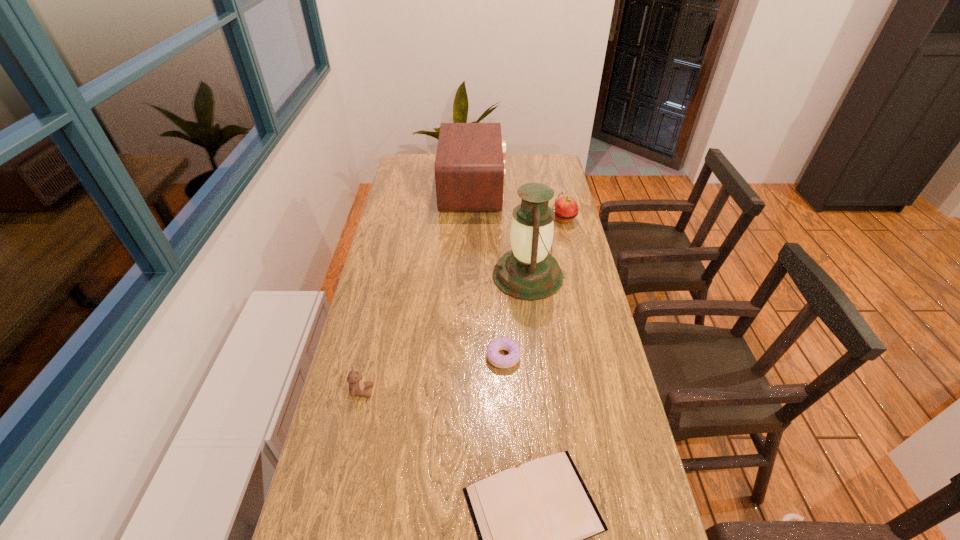
What are the coordinates of `lantern` in the screenshot? It's located at (529, 272).

Find the location of a particular element. The image size is (960, 540). the fourth nearest object is located at coordinates (529, 272).

Image resolution: width=960 pixels, height=540 pixels. In order to click on the fifth shortest object in this screenshot , I will do `click(469, 167)`.

Locate an element on the screen. This screenshot has width=960, height=540. the fourth shortest object is located at coordinates (566, 209).

Locate an element on the screen. the leftmost object is located at coordinates tap(357, 387).

This screenshot has height=540, width=960. I want to click on the fifth farthest object, so click(x=357, y=387).

This screenshot has width=960, height=540. Find the location of `doughnut`. doughnut is located at coordinates (503, 343).

The image size is (960, 540). I want to click on the third nearest object, so click(x=503, y=343).

Identify the location of free location located 0.050m with the light compartment facing forward on the tallest object. (478, 276).

Identify the location of free space located with the light compartment facing forward on the tallest object. (458, 276).